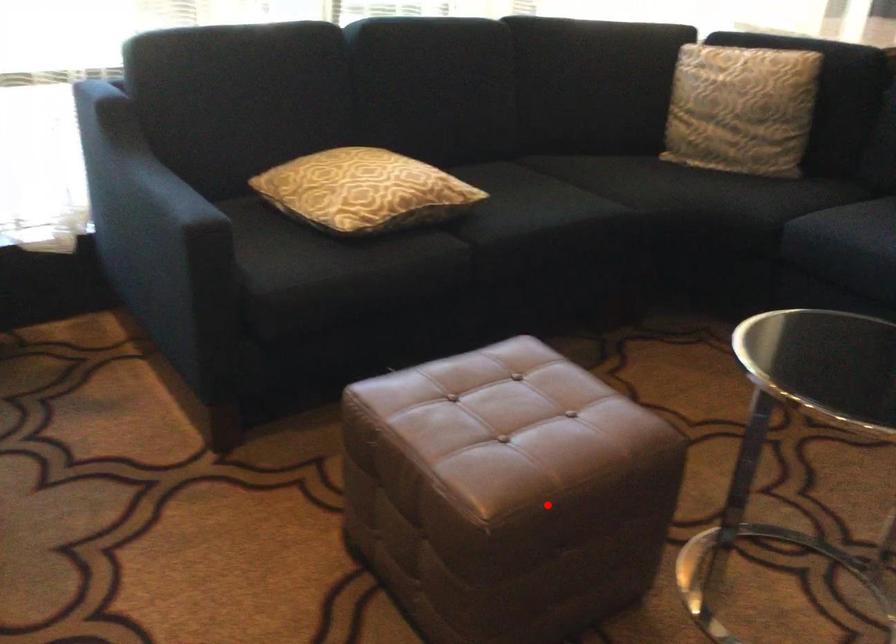
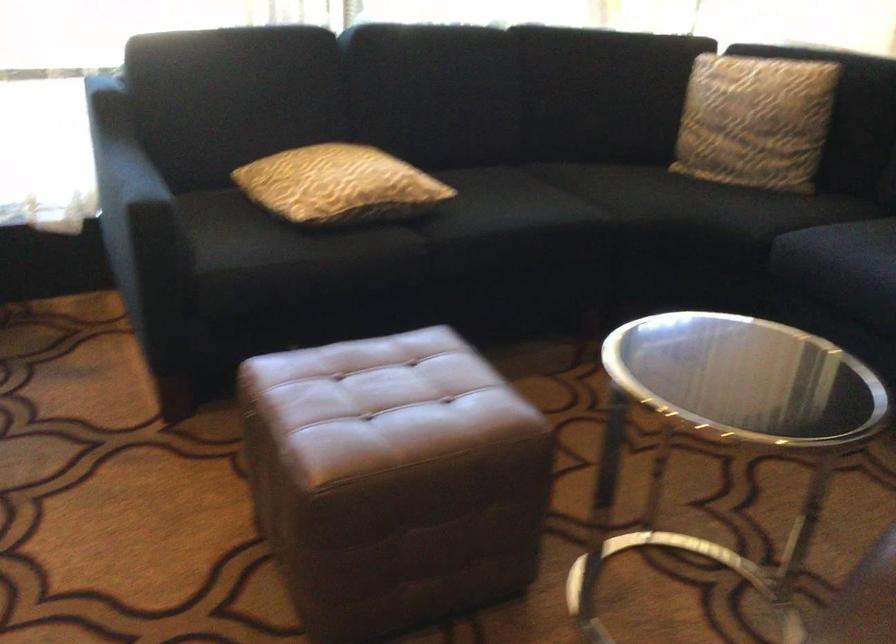
Where in the second image is the point corresponding to the highlighted location from the first image?

(392, 480)